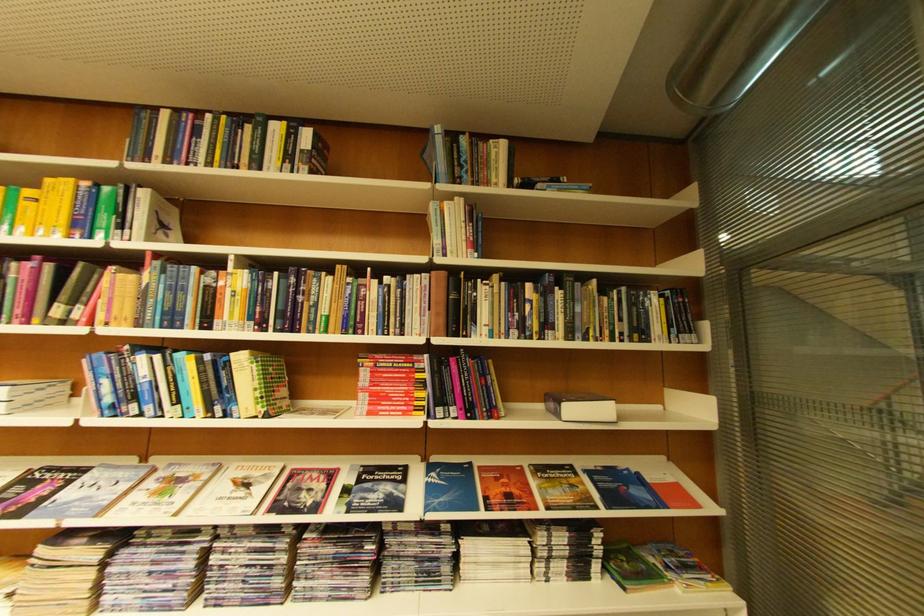
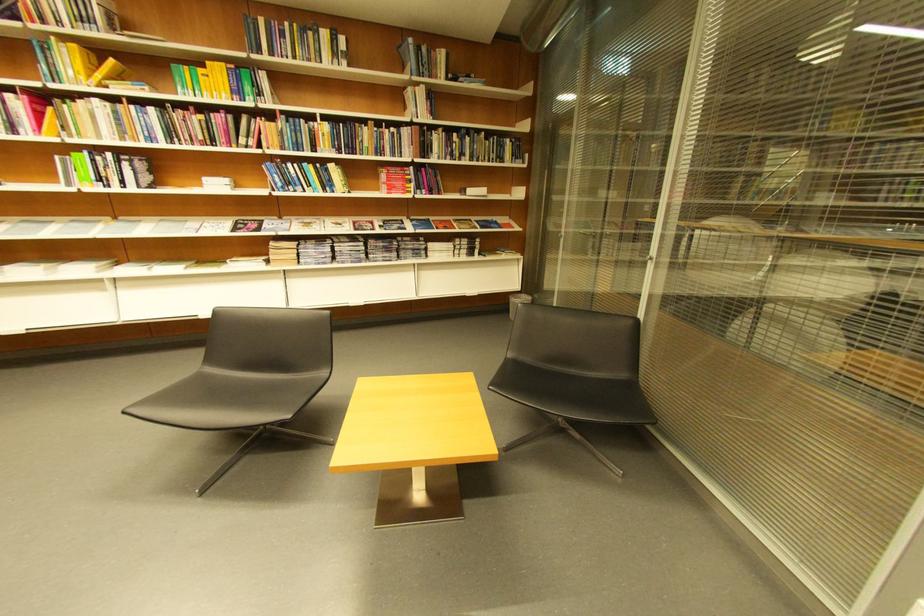
Locate, in the second image, the point that corresponds to pixel 396 363 in the first image.

(403, 172)